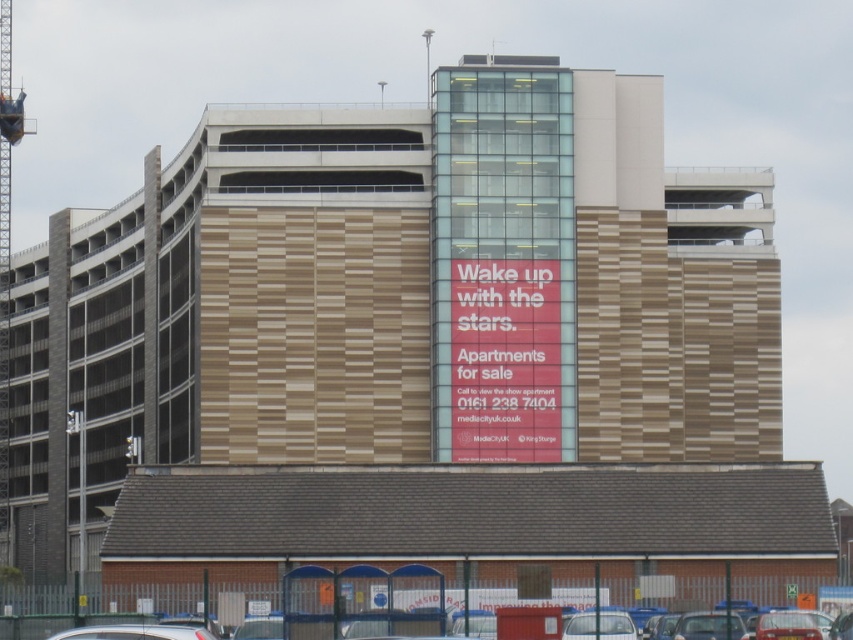
Question: Does red matte sign at center lie behind silver metallic car at lower left?

Choices:
 (A) no
 (B) yes

Answer: (B)

Question: Which point is farther to the camera?

Choices:
 (A) red matte sign at center
 (B) silver metallic car at lower left
 (C) metallic gray crane at left

Answer: (C)

Question: Is red matte sign at center closer to the viewer compared to silver metallic car at lower left?

Choices:
 (A) yes
 (B) no

Answer: (B)

Question: Which of the following is the farthest from the observer?

Choices:
 (A) metallic gray crane at left
 (B) red matte sign at center
 (C) silver metallic car at lower left

Answer: (A)

Question: Can you confirm if red matte sign at center is positioned to the right of silver metallic car at lower left?

Choices:
 (A) no
 (B) yes

Answer: (B)

Question: Which object is farther from the camera taking this photo?

Choices:
 (A) metallic gray crane at left
 (B) red matte sign at center
 (C) silver metallic car at lower left

Answer: (A)